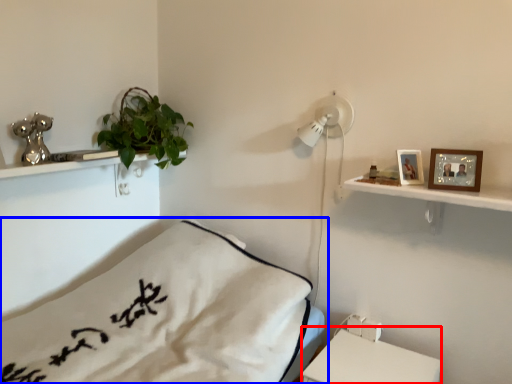
Question: Which point is further to the camera, table (highlighted by a red box) or bed (highlighted by a blue box)?

Choices:
 (A) table
 (B) bed

Answer: (A)